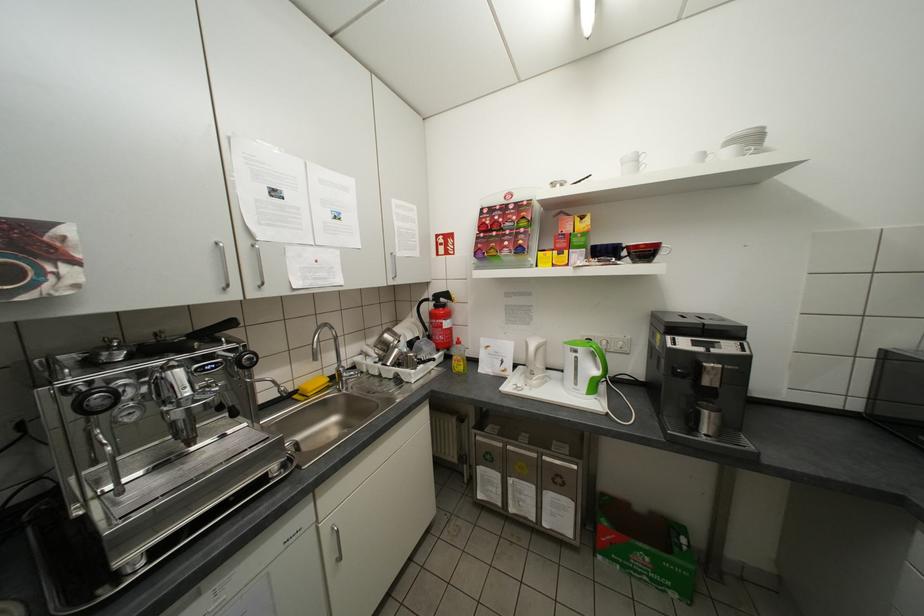
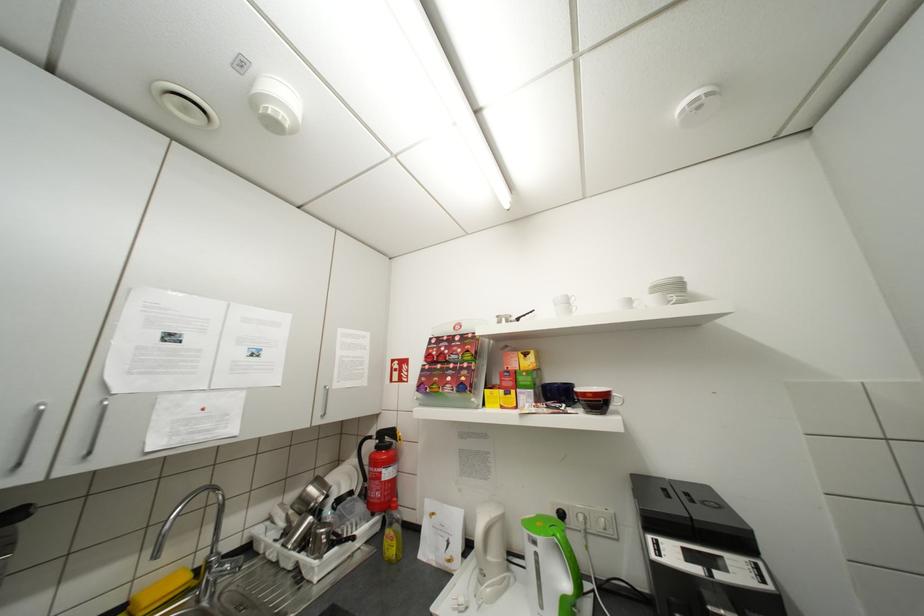
Question: Which direction would the cameraman need to move to produce the second image? Reply with the corresponding letter.

Choices:
 (A) Left
 (B) Right
 (C) Forward
 (D) Backward

Answer: (B)